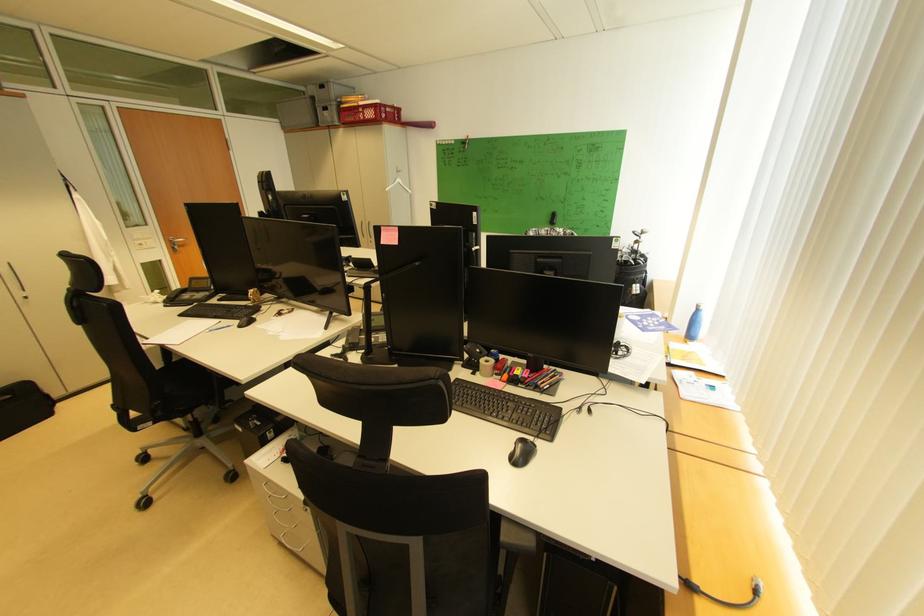
Where is `red plastic basket`? The image size is (924, 616). red plastic basket is located at coordinates (369, 113).